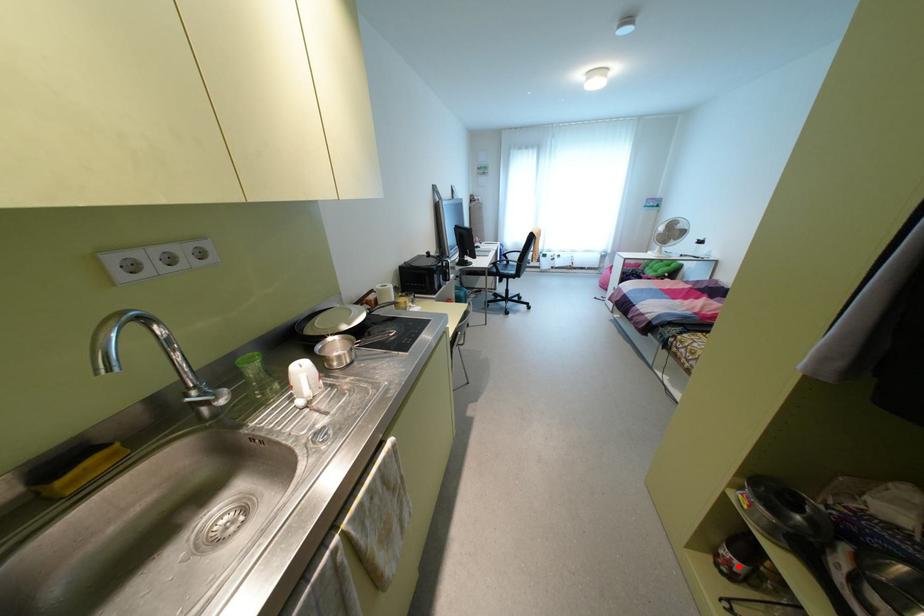
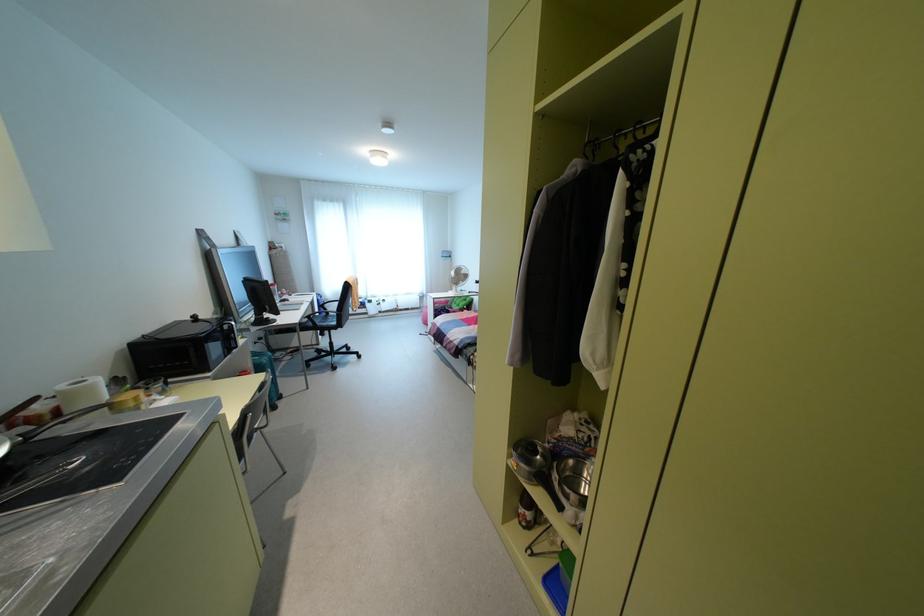
Locate, in the second image, the point that corresponds to the highlighted location in the first image.

(528, 515)